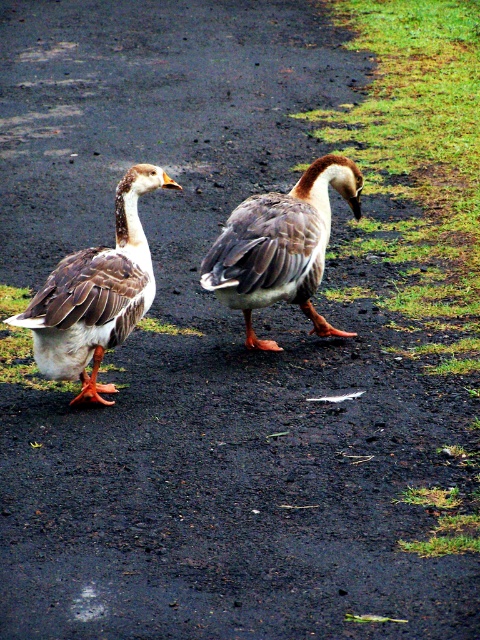
You are a birdwatcher observing two geese on a damp path. You notice a speckled feathered duck at left and brown speckled feathers at center. Which of these two objects is positioned more to the left?

The speckled feathered duck at left is positioned more to the left than the brown speckled feathers at center.

Consider the image. You are a birdwatcher observing two geese on a wet path. You notice a point marked at coordinates (96, 294). Which object corresponds to this point?

The point at (96, 294) corresponds to the speckled feathered duck at left.

You are a birdwatcher observing two birds in a park. You notice the speckled feathered duck at left and the brown speckled feathers at center. Which bird is taller?

The speckled feathered duck at left is taller than the brown speckled feathers at center according to the description.